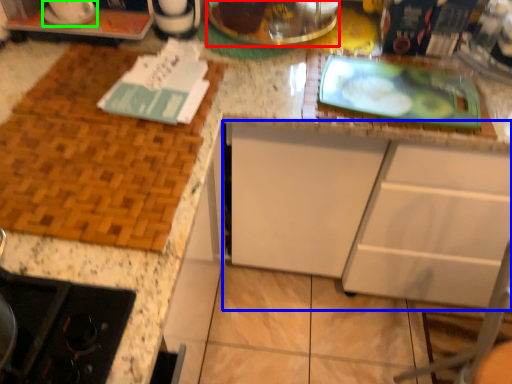
Question: Based on their relative distances, which object is farther from appliance (highlighted by a red box)? Choose from cabinetry (highlighted by a blue box) and appliance (highlighted by a green box).

Choices:
 (A) cabinetry
 (B) appliance

Answer: (A)